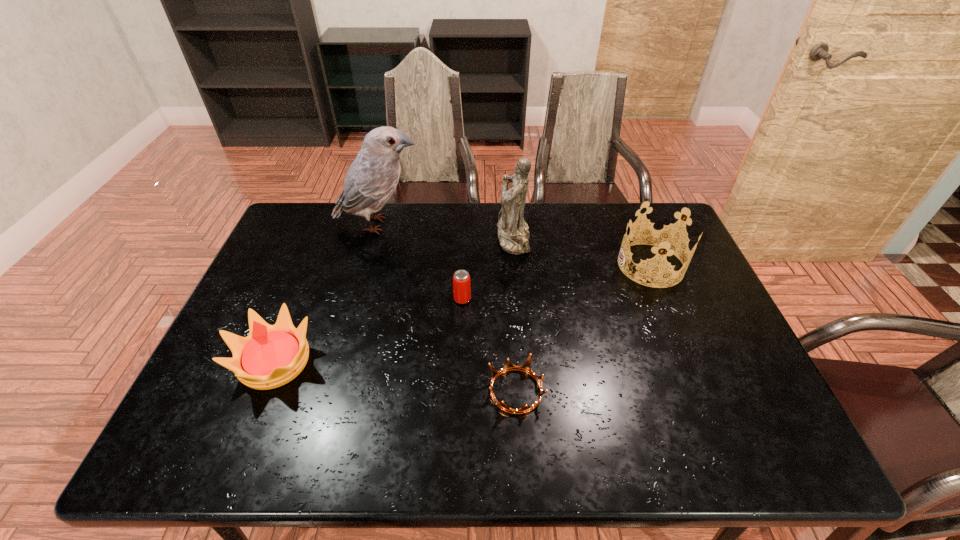
I want to click on free region located 0.170m on the front-facing side of the fifth shortest object, so click(x=445, y=238).

Locate an element on the screen. Image resolution: width=960 pixels, height=540 pixels. free space located 0.340m on the front-facing side of the fifth shortest object is located at coordinates (393, 238).

Locate an element on the screen. blank space located 0.150m on the front-facing side of the fifth shortest object is located at coordinates (451, 238).

Find the location of a particular element. Image resolution: width=960 pixels, height=540 pixels. vacant region located 0.110m on the front of the rightmost object is located at coordinates (672, 317).

What are the coordinates of `free region located on the right of the leftmost crown` in the screenshot? It's located at (395, 362).

Identify the location of vacant space located on the left of the fourth object from right to left. This screenshot has height=540, width=960. (404, 299).

Image resolution: width=960 pixels, height=540 pixels. What are the coordinates of `vacant space located 0.290m on the back of the shortest crown` in the screenshot? It's located at (509, 284).

This screenshot has height=540, width=960. In order to click on parrot positioned at the far edge in this screenshot , I will do `click(371, 179)`.

What are the coordinates of `figurine that is at the far edge` in the screenshot? It's located at pos(513,234).

The image size is (960, 540). I want to click on crown that is positioned at the far edge, so click(660, 239).